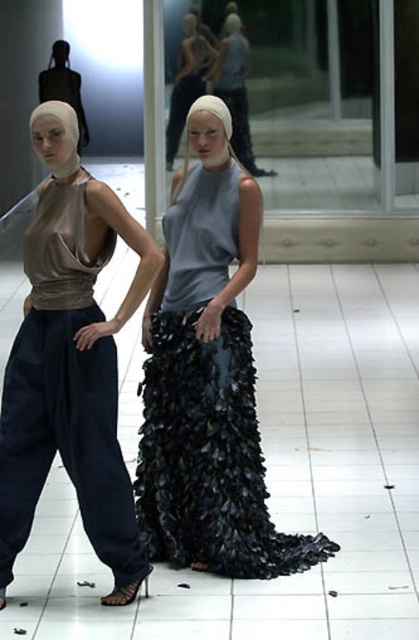
You are an interior designer assessing the placement of a new sculpture in the gallery. The sculpture is 1.2 meters tall and needs to be placed where it won???t block the view of the glass wall. The point at coordinates [70,360] indicates the location of the matte brown fabric top at left. Can you determine if placing the sculpture at this point would block the view of the glass wall?

The point at coordinates [70,360] marks the location of the matte brown fabric top at left. Since the sculpture is 1.2 meters tall, placing it at this point might block the view of the glass wall, as the figure wearing the matte brown fabric top is already positioned there and could obstruct the line of sight.

You are an artist trying to paint the scene. You want to focus on the details of the matte brown fabric top at left and the matte gray dress at center. Which one should you paint first to ensure proper perspective?

The matte brown fabric top at left should be painted first because it is closer to the viewer than the matte gray dress at center, so it should be depicted with more detail and prominence in the foreground.

You are a photographer setting up a shoot in this space. You want to ensure both the shiny black fabric dress at center and the matte brown fabric top at left are in focus. Since depth of field is limited, which subject should you focus on to capture both effectively?

The shiny black fabric dress at center is closer to the viewer than the matte brown fabric top at left. To capture both in focus, focus on the shiny black fabric dress at center since it is the closer subject, allowing the depth of field to extend backward to include the matte brown fabric top at left.